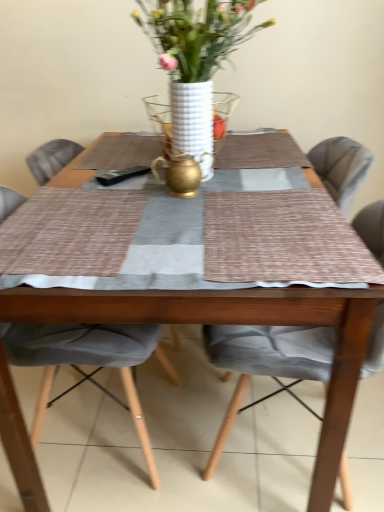
You are a GUI agent. You are given a task and a screenshot of the screen. Output one action in this format:
    pyautogui.click(x=<x>, y=<y>)
    Task: Click on the wooden table at center
    
    Given the screenshot: What is the action you would take?
    pyautogui.click(x=205, y=305)

Describe the element at coordinates (265, 361) in the screenshot. I see `textured gray cushion at center, acting as the 2th chair starting from the left` at that location.

In order to click on white textured vase at center in this screenshot , I will do `click(191, 122)`.

Image resolution: width=384 pixels, height=512 pixels. In order to click on white ceramic vase at center in this screenshot , I will do `click(195, 62)`.

Identify the location of wooden table at center. The image size is (384, 512). (205, 305).

Who is taller, textured gray cushion at center, which is the 1th chair in right-to-left order, or white textured vase at center?

With more height is textured gray cushion at center, which is the 1th chair in right-to-left order.

Is textured gray cushion at center, which is the 1th chair in right-to-left order, far from white textured vase at center?

No.

Relative to white textured vase at center, is textured gray cushion at center, which is the 1th chair in right-to-left order, in front or behind?

textured gray cushion at center, which is the 1th chair in right-to-left order, is positioned closer to the viewer than white textured vase at center.

From a real-world perspective, which object stands above the other?

white textured vase at center.

Between wooden table at center and white textured vase at center, which one is positioned in front?

Positioned in front is wooden table at center.

Is wooden table at center far from white textured vase at center?

No, wooden table at center is not far away from white textured vase at center.

Can you confirm if wooden table at center is thinner than white textured vase at center?

No.

Which of these two, wooden table at center or white textured vase at center, stands shorter?

Standing shorter between the two is white textured vase at center.

This screenshot has height=512, width=384. I want to click on chair on the left of textured gray cushion at center, acting as the 2th chair starting from the left, so click(87, 362).

Is gray fabric chair at center, the 2th chair in the right-to-left sequence, aimed at textured gray cushion at center, acting as the 2th chair starting from the left?

Yes, gray fabric chair at center, the 2th chair in the right-to-left sequence, is oriented towards textured gray cushion at center, acting as the 2th chair starting from the left.

Considering the relative positions of gray fabric chair at center, placed as the 1th chair when sorted from left to right, and textured gray cushion at center, which is the 1th chair in right-to-left order, in the image provided, is gray fabric chair at center, placed as the 1th chair when sorted from left to right, to the right of textured gray cushion at center, which is the 1th chair in right-to-left order, from the viewer's perspective?

Incorrect, gray fabric chair at center, placed as the 1th chair when sorted from left to right, is not on the right side of textured gray cushion at center, which is the 1th chair in right-to-left order.

Is the position of gray fabric chair at center, the 2th chair in the right-to-left sequence, more distant than that of textured gray cushion at center, acting as the 2th chair starting from the left?

Yes, gray fabric chair at center, the 2th chair in the right-to-left sequence, is further from the viewer.

Is white textured vase at center next to gray fabric chair at center, placed as the 1th chair when sorted from left to right, and touching it?

white textured vase at center and gray fabric chair at center, placed as the 1th chair when sorted from left to right, are not in contact.

Is white textured vase at center oriented towards gray fabric chair at center, the 2th chair in the right-to-left sequence?

No, white textured vase at center is not oriented towards gray fabric chair at center, the 2th chair in the right-to-left sequence.

I want to click on glass vase lying behind the gray fabric chair at center, placed as the 1th chair when sorted from left to right, so click(191, 122).

Does textured gray cushion at center, which is the 1th chair in right-to-left order, contain wooden table at center?

No, wooden table at center is located outside of textured gray cushion at center, which is the 1th chair in right-to-left order.

From the picture: Is textured gray cushion at center, acting as the 2th chair starting from the left, bigger than wooden table at center?

Incorrect, textured gray cushion at center, acting as the 2th chair starting from the left, is not larger than wooden table at center.

From a real-world perspective, which is physically above, textured gray cushion at center, which is the 1th chair in right-to-left order, or wooden table at center?

In real-world perspective, wooden table at center is above.

Is textured gray cushion at center, which is the 1th chair in right-to-left order, wider than wooden table at center?

No.

Which is correct: white textured vase at center is inside white ceramic vase at center, or outside of it?

The correct answer is: inside.

Does white textured vase at center have a larger size compared to white ceramic vase at center?

Actually, white textured vase at center might be smaller than white ceramic vase at center.

Is white ceramic vase at center at the back of white textured vase at center?

No, white textured vase at center is not facing away from white ceramic vase at center.

From a real-world perspective, does white textured vase at center stand above white ceramic vase at center?

No, from a real-world perspective, white textured vase at center is not over white ceramic vase at center

Is white ceramic vase at center outside of textured gray cushion at center, acting as the 2th chair starting from the left?

Yes, white ceramic vase at center is not within textured gray cushion at center, acting as the 2th chair starting from the left.

Is white ceramic vase at center directly adjacent to textured gray cushion at center, acting as the 2th chair starting from the left?

There is a gap between white ceramic vase at center and textured gray cushion at center, acting as the 2th chair starting from the left.

Considering the relative sizes of white ceramic vase at center and textured gray cushion at center, which is the 1th chair in right-to-left order, in the image provided, is white ceramic vase at center thinner than textured gray cushion at center, which is the 1th chair in right-to-left order,?

Yes.

Is the position of white ceramic vase at center less distant than that of textured gray cushion at center, which is the 1th chair in right-to-left order?

No, white ceramic vase at center is further to the viewer.

You are a GUI agent. You are given a task and a screenshot of the screen. Output one action in this format:
    pyautogui.click(x=<x>, y=<y>)
    Task: Click on the chair lying on the right of white textured vase at center
    This screenshot has width=384, height=512.
    Given the screenshot: What is the action you would take?
    pyautogui.click(x=265, y=361)

Identify the location of glass vase lying behind the wooden table at center. The height and width of the screenshot is (512, 384). 191,122.

When comparing their distances from gray fabric chair at center, placed as the 1th chair when sorted from left to right, does wooden table at center or textured gray cushion at center, which is the 1th chair in right-to-left order, seem closer?

wooden table at center lies closer to gray fabric chair at center, placed as the 1th chair when sorted from left to right, than the other object.

Considering their positions, is textured gray cushion at center, which is the 1th chair in right-to-left order, positioned closer to white ceramic vase at center than white textured vase at center?

white textured vase at center is positioned closer to the anchor white ceramic vase at center.

Estimate the real-world distances between objects in this image. Which object is further from white textured vase at center, gray fabric chair at center, placed as the 1th chair when sorted from left to right, or wooden table at center?

wooden table at center lies further to white textured vase at center than the other object.

From the image, which object appears to be nearer to white textured vase at center, gray fabric chair at center, placed as the 1th chair when sorted from left to right, or white ceramic vase at center?

white ceramic vase at center.

Which object lies nearer to the anchor point wooden table at center, white ceramic vase at center or gray fabric chair at center, placed as the 1th chair when sorted from left to right?

gray fabric chair at center, placed as the 1th chair when sorted from left to right, lies closer to wooden table at center than the other object.

Consider the image. Considering their positions, is white textured vase at center positioned closer to wooden table at center than textured gray cushion at center, acting as the 2th chair starting from the left?

Based on the image, textured gray cushion at center, acting as the 2th chair starting from the left, appears to be nearer to wooden table at center.

Which object lies further to the anchor point white ceramic vase at center, white textured vase at center or wooden table at center?

wooden table at center is positioned further to the anchor white ceramic vase at center.

Looking at the image, which one is located closer to wooden table at center, textured gray cushion at center, which is the 1th chair in right-to-left order, or white ceramic vase at center?

The object closer to wooden table at center is textured gray cushion at center, which is the 1th chair in right-to-left order.

Identify the location of kitchen & dining room table between white textured vase at center and gray fabric chair at center, placed as the 1th chair when sorted from left to right, in the up-down direction. 205,305.

Locate an element on the screen. kitchen & dining room table between white ceramic vase at center and gray fabric chair at center, placed as the 1th chair when sorted from left to right, vertically is located at coordinates (205, 305).

In order to click on kitchen & dining room table between gray fabric chair at center, placed as the 1th chair when sorted from left to right, and textured gray cushion at center, which is the 1th chair in right-to-left order, from left to right in this screenshot , I will do `click(205, 305)`.

Find the location of `chair between white ceramic vase at center and textured gray cushion at center, which is the 1th chair in right-to-left order, from top to bottom`. chair between white ceramic vase at center and textured gray cushion at center, which is the 1th chair in right-to-left order, from top to bottom is located at coordinates pyautogui.click(x=87, y=362).